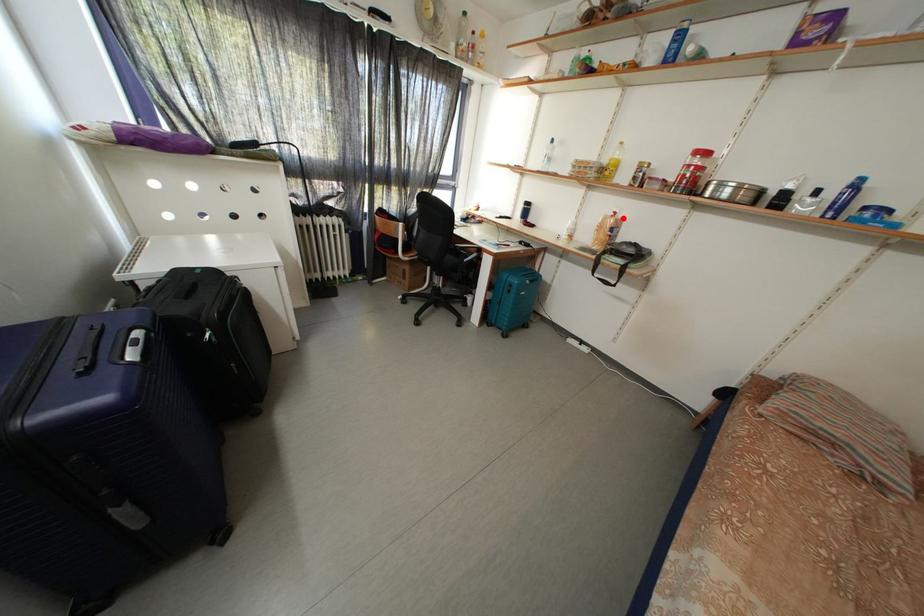
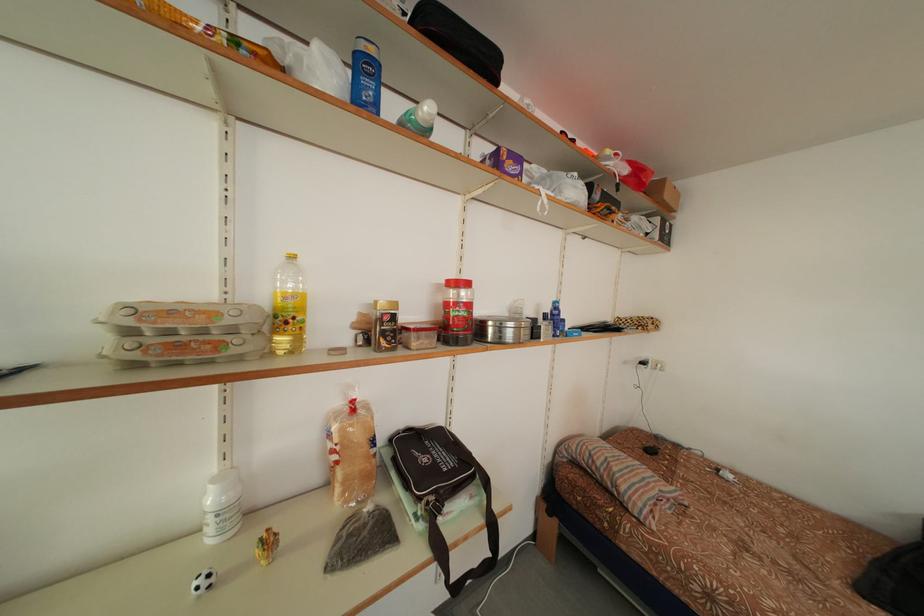
Find the pixel in the second image that matches the highlighted location in the first image.

(360, 407)